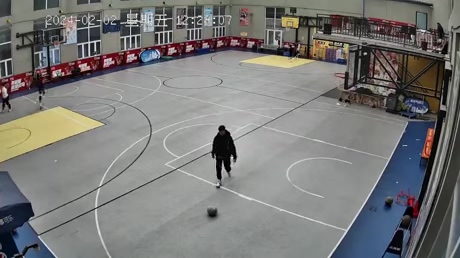
Locate an element on the screen. Image resolution: width=460 pixels, height=258 pixels. wall is located at coordinates (108, 41).